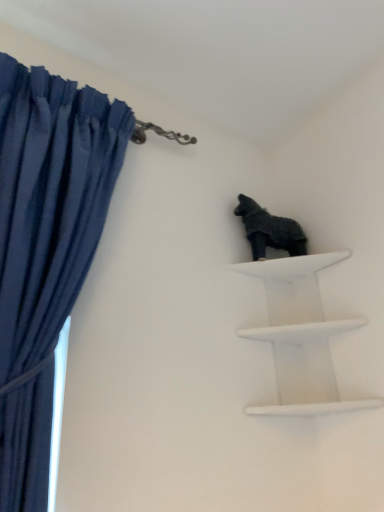
The width and height of the screenshot is (384, 512). Describe the element at coordinates (300, 337) in the screenshot. I see `white matte shelf at upper right` at that location.

Describe the element at coordinates (45, 248) in the screenshot. The width and height of the screenshot is (384, 512). I see `dark blue fabric at left` at that location.

Locate an element on the screen. white matte shelf at upper right is located at coordinates (300, 337).

Can you confirm if shiny black statue at upper right is positioned to the left of white matte shelf at upper right?

Indeed, shiny black statue at upper right is positioned on the left side of white matte shelf at upper right.

Considering the sizes of objects shiny black statue at upper right and white matte shelf at upper right in the image provided, who is thinner, shiny black statue at upper right or white matte shelf at upper right?

shiny black statue at upper right.

In the scene shown: From a real-world perspective, which is physically above, shiny black statue at upper right or white matte shelf at upper right?

From a 3D spatial view, shiny black statue at upper right is above.

Could you tell me if shiny black statue at upper right is turned towards white matte shelf at upper right?

No, shiny black statue at upper right is not facing towards white matte shelf at upper right.

Is point (317, 356) positioned after point (55, 177)?

Yes, point (317, 356) is behind point (55, 177).

Could you tell me if white matte shelf at upper right is turned towards dark blue fabric at left?

No, white matte shelf at upper right is not turned towards dark blue fabric at left.

Does white matte shelf at upper right have a lesser width compared to dark blue fabric at left?

No.

Does white matte shelf at upper right have a larger size compared to dark blue fabric at left?

Incorrect, white matte shelf at upper right is not larger than dark blue fabric at left.

Considering the relative sizes of dark blue fabric at left and shiny black statue at upper right in the image provided, is dark blue fabric at left thinner than shiny black statue at upper right?

Incorrect, the width of dark blue fabric at left is not less than that of shiny black statue at upper right.

Which of these two, dark blue fabric at left or shiny black statue at upper right, stands taller?

Standing taller between the two is dark blue fabric at left.

What are the coordinates of `curtain located on the left of shiny black statue at upper right` in the screenshot? It's located at (45, 248).

From a real-world perspective, which object stands above the other?

From a 3D spatial view, shiny black statue at upper right is above.

From a real-world perspective, which is physically below, white matte shelf at upper right or shiny black statue at upper right?

In real-world perspective, white matte shelf at upper right is lower.

Considering the points (280, 291) and (246, 213), which point is in front, point (280, 291) or point (246, 213)?

The point (246, 213) is closer to the camera.

Considering the sizes of white matte shelf at upper right and shiny black statue at upper right in the image, is white matte shelf at upper right taller or shorter than shiny black statue at upper right?

Answer: Considering their sizes, white matte shelf at upper right has more height than shiny black statue at upper right.

Which object is wider, white matte shelf at upper right or shiny black statue at upper right?

white matte shelf at upper right is wider.

Is point (61, 116) positioned in front of point (321, 413)?

Yes, point (61, 116) is closer to viewer.

From a real-world perspective, is dark blue fabric at left on white matte shelf at upper right?

Yes.

In terms of size, does dark blue fabric at left appear bigger or smaller than white matte shelf at upper right?

In the image, dark blue fabric at left appears to be larger than white matte shelf at upper right.

Find the location of a particular element. This screenshot has width=384, height=512. curtain above the white matte shelf at upper right (from the image's perspective) is located at coordinates (45, 248).

Is shiny black statue at upper right bigger than dark blue fabric at left?

No, shiny black statue at upper right is not bigger than dark blue fabric at left.

Considering the positions of objects shiny black statue at upper right and dark blue fabric at left in the image provided, who is behind, shiny black statue at upper right or dark blue fabric at left?

shiny black statue at upper right is further from the camera.

Is shiny black statue at upper right spatially inside dark blue fabric at left, or outside of it?

shiny black statue at upper right lies outside dark blue fabric at left.

The image size is (384, 512). Find the location of `shelf in front of the shiny black statue at upper right`. shelf in front of the shiny black statue at upper right is located at coordinates (300, 337).

Find the location of `shelf below the dark blue fabric at left (from the image's perspective)`. shelf below the dark blue fabric at left (from the image's perspective) is located at coordinates (300, 337).

From the image, which object appears to be farther from dark blue fabric at left, white matte shelf at upper right or shiny black statue at upper right?

white matte shelf at upper right lies further to dark blue fabric at left than the other object.

Looking at the image, which one is located closer to white matte shelf at upper right, shiny black statue at upper right or dark blue fabric at left?

shiny black statue at upper right lies closer to white matte shelf at upper right than the other object.

From the image, which object appears to be nearer to dark blue fabric at left, shiny black statue at upper right or white matte shelf at upper right?

shiny black statue at upper right lies closer to dark blue fabric at left than the other object.

From the image, which object appears to be nearer to shiny black statue at upper right, white matte shelf at upper right or dark blue fabric at left?

white matte shelf at upper right.

Consider the image. Considering their positions, is dark blue fabric at left positioned closer to white matte shelf at upper right than shiny black statue at upper right?

shiny black statue at upper right is closer to white matte shelf at upper right.

When comparing their distances from shiny black statue at upper right, does dark blue fabric at left or white matte shelf at upper right seem further?

dark blue fabric at left is further to shiny black statue at upper right.

Locate an element on the screen. shelf between dark blue fabric at left and shiny black statue at upper right in the front-back direction is located at coordinates (300, 337).